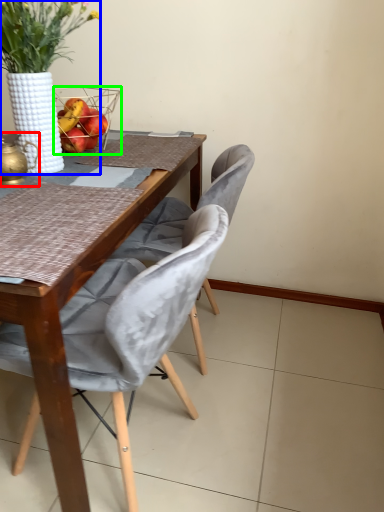
Question: Considering the real-world distances, which object is closest to tea pot (highlighted by a red box)? houseplant (highlighted by a blue box) or picnic basket (highlighted by a green box).

Choices:
 (A) houseplant
 (B) picnic basket

Answer: (A)